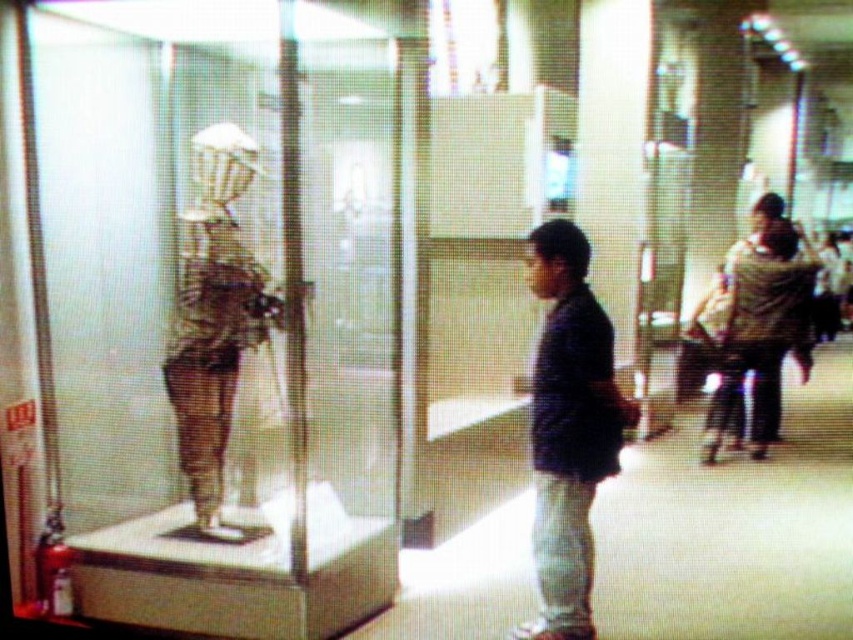
You are standing in a museum and see a dark blue shirt at center. If you want to get a closer look at the skeleton in the display case, should you move forward or backward?

You should move forward to get closer to the dark blue shirt at center, as you and the dark blue shirt at center are 10.23 feet apart. Moving forward would reduce the distance between you and the skeleton in the display case.

You are standing at the entrance of the museum and want to approach the brown wooden skeleton at center. The fire extinguisher is partially visible at the bottom left corner of the display case. How far apart are you and the skeleton?

The distance between you and the brown wooden skeleton at center is 3.44 meters.

You are a visitor in the museum and want to take a photo of the brown wooden skeleton at center and the brown textured jacket at right. Which object should you focus on first if you want to capture both in the same frame without moving your camera?

The brown wooden skeleton at center is to the left of brown textured jacket at right, so you should focus on the brown wooden skeleton at center first to ensure both are in the frame.